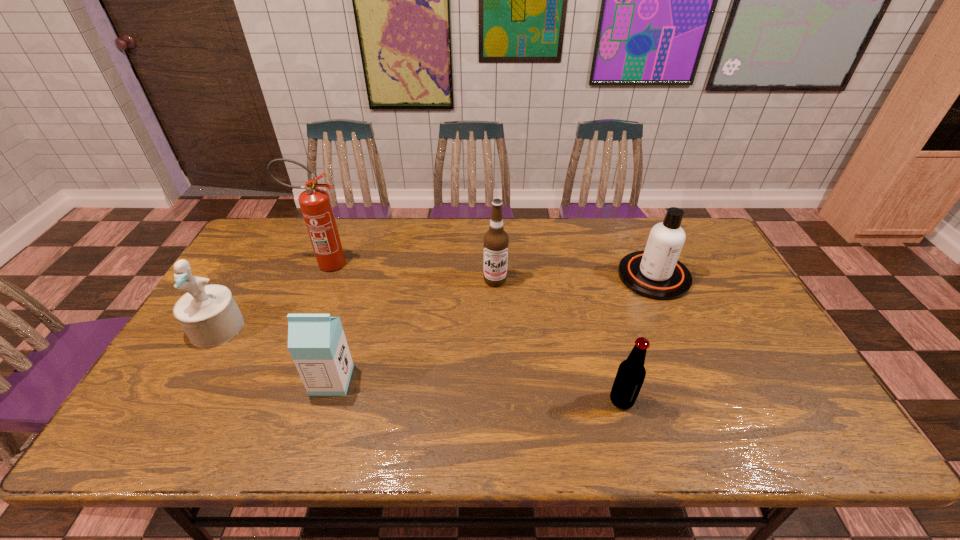
Where is `free point between the fifth shortest object and the fire extinguisher`? The height and width of the screenshot is (540, 960). free point between the fifth shortest object and the fire extinguisher is located at coordinates (410, 272).

What are the coordinates of `blank region between the figurine and the tallest object` in the screenshot? It's located at (272, 296).

Locate an element on the screen. The height and width of the screenshot is (540, 960). free spot between the fifth object from right to left and the alcohol is located at coordinates (410, 272).

Identify the location of blank region between the fourth farthest object and the milk carton. (275, 354).

Image resolution: width=960 pixels, height=540 pixels. I want to click on the third closest object to the third nearest object, so click(x=496, y=240).

Locate which object is the fourth closest to the alcohol. Please provide its 2D coordinates. Your answer should be formatted as a tuple, i.e. [(x, y)], where the tuple contains the x and y coordinates of a point satisfying the conditions above.

[(317, 343)]

Where is `vacant position in the image that satisfies the following two spatial constraints: 1. from the nozzle of the fifth object from left to right; 2. on the left side of the fifth object from right to left`? vacant position in the image that satisfies the following two spatial constraints: 1. from the nozzle of the fifth object from left to right; 2. on the left side of the fifth object from right to left is located at coordinates (271, 400).

This screenshot has height=540, width=960. I want to click on free space that satisfies the following two spatial constraints: 1. from the nozzle of the beer bottle; 2. on the right side of the fifth object from right to left, so click(x=271, y=400).

Image resolution: width=960 pixels, height=540 pixels. I want to click on vacant space that satisfies the following two spatial constraints: 1. at the beak of the fourth farthest object; 2. on the left side of the fifth object from left to right, so (175, 400).

At what (x,y) coordinates should I click in order to perform the action: click on vacant position in the image that satisfies the following two spatial constraints: 1. from the nozzle of the fourth object from right to left; 2. on the left side of the tallest object. Please return your answer as a coordinate pair (x, y). The width and height of the screenshot is (960, 540). Looking at the image, I should click on (278, 380).